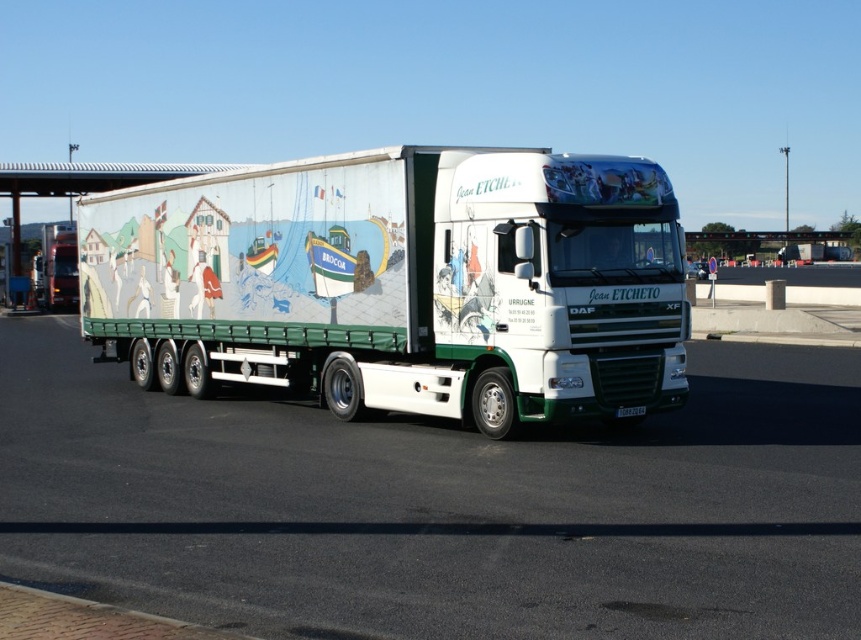
Between gray concrete highway at center and white plastic license plate at center, which one is positioned higher?

gray concrete highway at center

In order to click on gray concrete highway at center in this screenshot , I will do `click(793, 275)`.

Does white glossy truck at center have a greater height compared to white plastic license plate at center?

Yes.

Who is lower down, white glossy truck at center or white plastic license plate at center?

white plastic license plate at center is below.

Between point (265, 211) and point (623, 410), which one is positioned behind?

The point (265, 211) is behind.

Where is `white glossy truck at center`? The height and width of the screenshot is (640, 861). white glossy truck at center is located at coordinates (400, 282).

Can you confirm if white asphalt highway at center is taller than white glossy truck at center?

No, white asphalt highway at center is not taller than white glossy truck at center.

What do you see at coordinates (438, 506) in the screenshot?
I see `white asphalt highway at center` at bounding box center [438, 506].

Which is behind, point (468, 477) or point (325, 196)?

The point (325, 196) is more distant.

Locate an element on the screen. This screenshot has width=861, height=640. white asphalt highway at center is located at coordinates (438, 506).